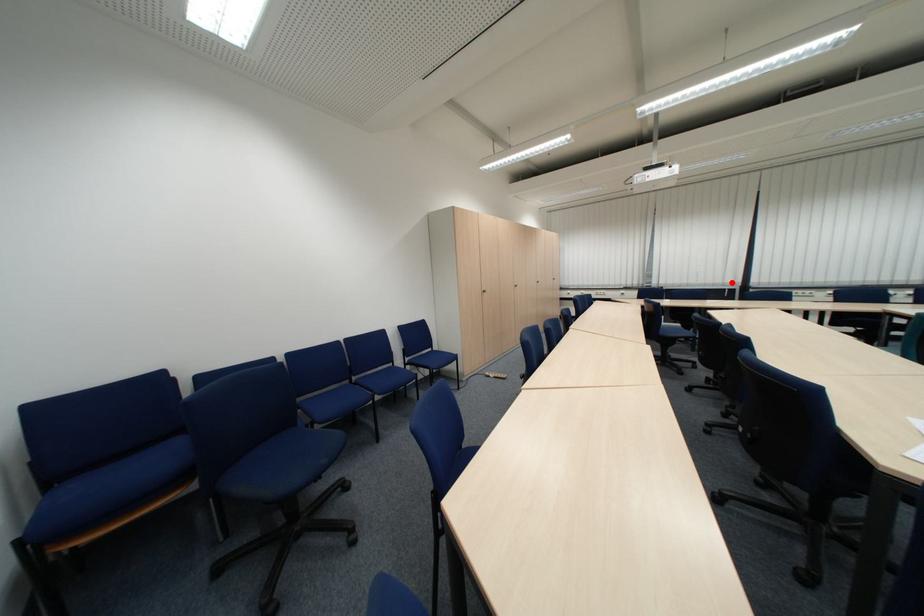
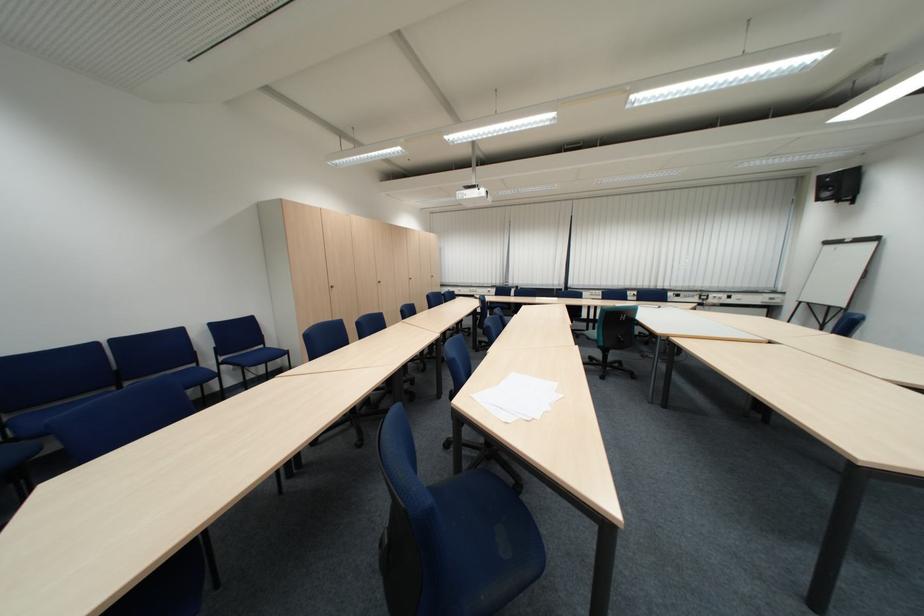
Locate, in the second image, the point that corresponds to the highlighted location in the first image.

(564, 284)